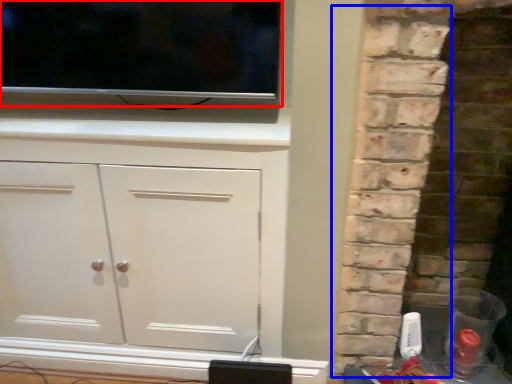
Question: Which object is further to the camera taking this photo, tv show (highlighted by a red box) or brickwork (highlighted by a blue box)?

Choices:
 (A) tv show
 (B) brickwork

Answer: (A)